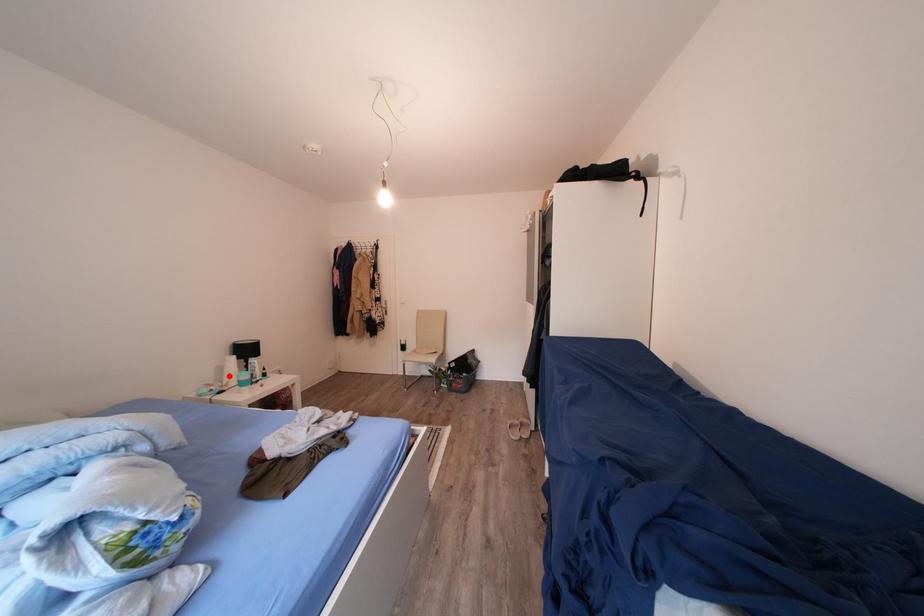
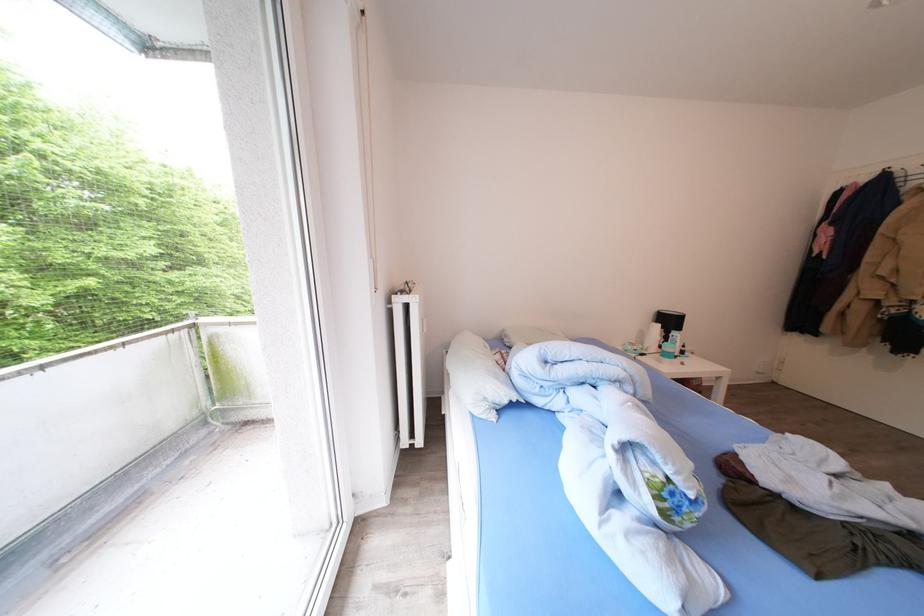
Question: I am providing you with two images of the same scene from different viewpoints. Given a red point in image1, look at the same physical point in image2. Is it:

Choices:
 (A) Closer to the viewpoint
 (B) Farther from the viewpoint

Answer: (A)